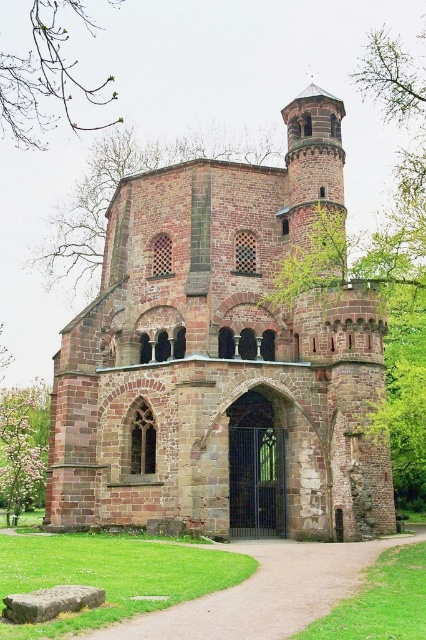
Question: Is dirt/gravel path at center smaller than green leafy tree at lower left?

Choices:
 (A) no
 (B) yes

Answer: (B)

Question: Does dirt/gravel path at center appear under green leafy tree at lower left?

Choices:
 (A) no
 (B) yes

Answer: (A)

Question: Estimate the real-world distances between objects in this image. Which object is closer to the dirt/gravel path at center?

Choices:
 (A) green leafy tree at lower left
 (B) green leafy tree at upper center
 (C) brown stone church at center

Answer: (C)

Question: Can you confirm if brown stone church at center is bigger than dirt/gravel path at center?

Choices:
 (A) yes
 (B) no

Answer: (A)

Question: Which point is closer to the camera taking this photo?

Choices:
 (A) (34, 81)
 (B) (32, 388)
 (C) (365, 557)
 (D) (74, 269)

Answer: (C)

Question: Which object is the closest to the green leafy tree at lower left?

Choices:
 (A) green leafy tree at upper center
 (B) green leafy branches at upper left
 (C) brown stone church at center

Answer: (A)